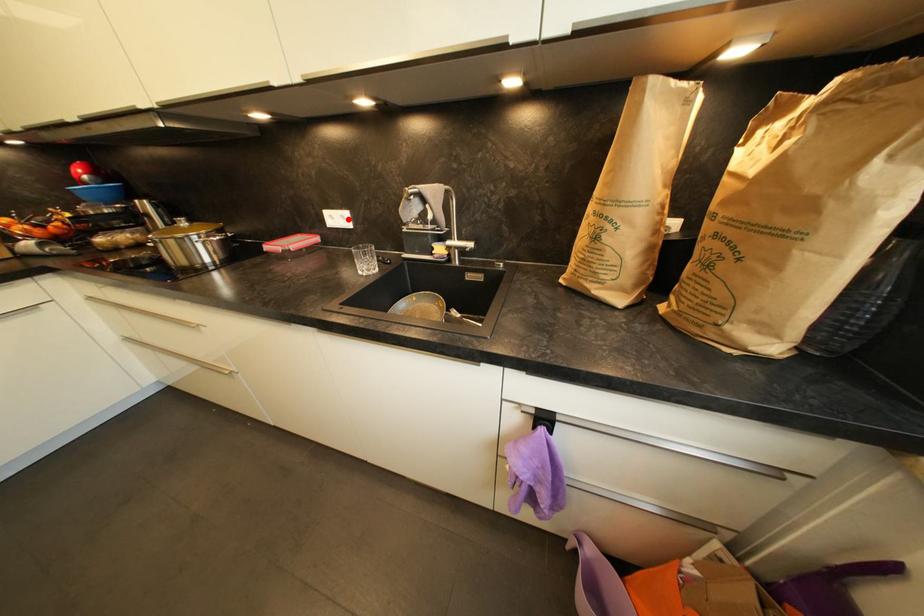
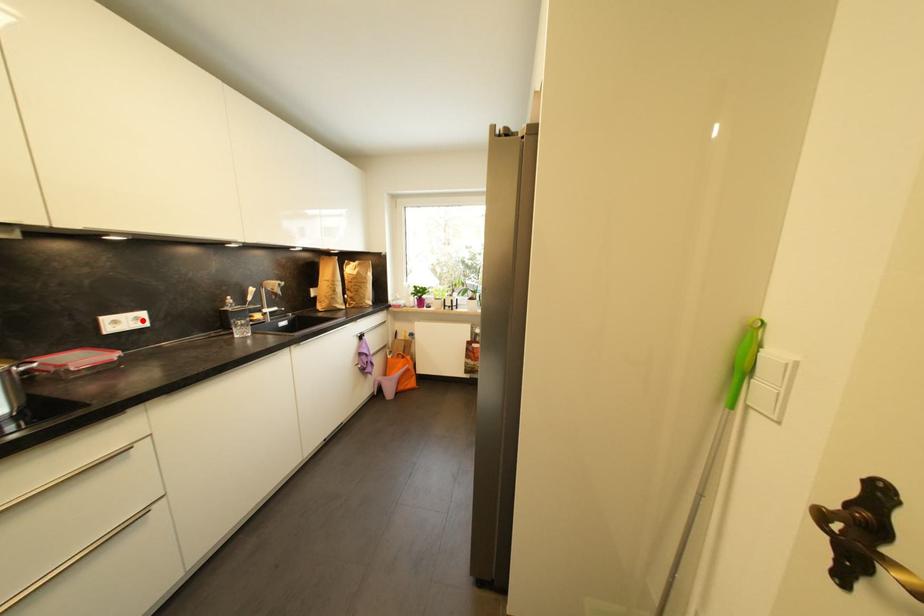
I am providing you with two images of the same scene from different viewpoints. A red point is marked on the first image and another point is marked on the second image. Is the red point in image1 aligned with the point shown in image2?

Yes